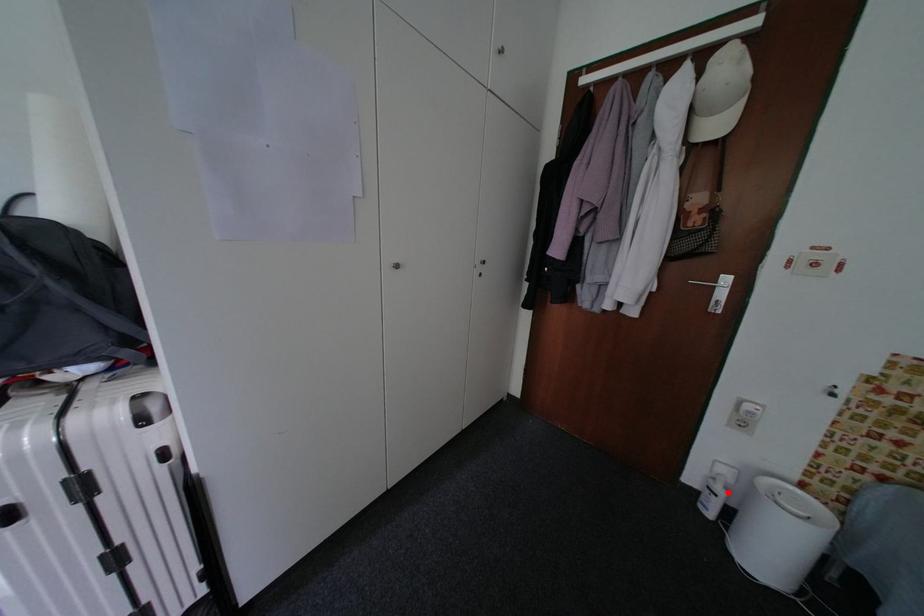
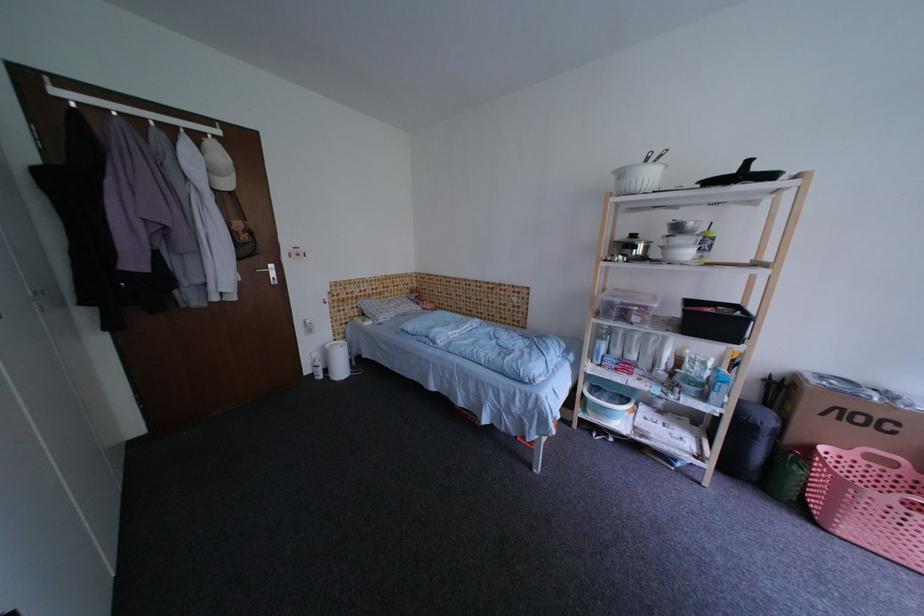
Question: I am providing you with two images of the same scene from different viewpoints. Given a red point in image1, look at the same physical point in image2. Is it:

Choices:
 (A) Closer to the viewpoint
 (B) Farther from the viewpoint

Answer: (B)